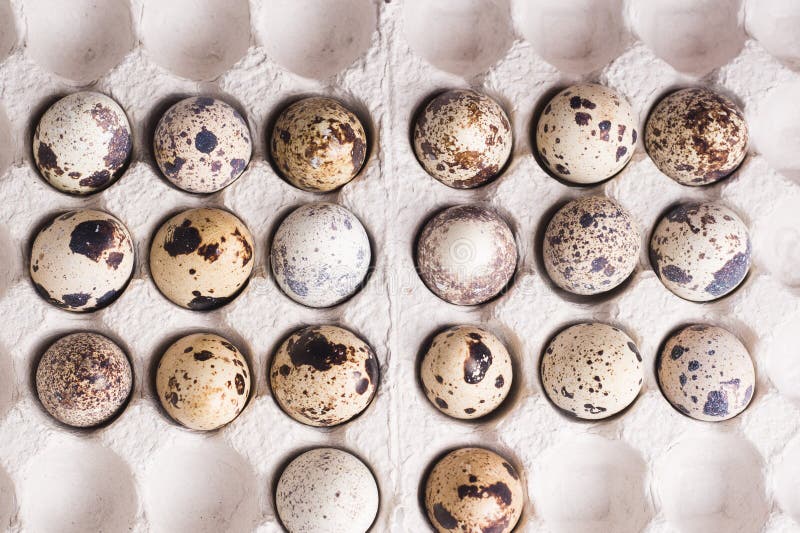
Find the location of `empty slots in the egg carton`. empty slots in the egg carton is located at coordinates (82, 499), (190, 499), (577, 487), (706, 486), (694, 36), (562, 31), (469, 29), (310, 31), (196, 30), (86, 32).